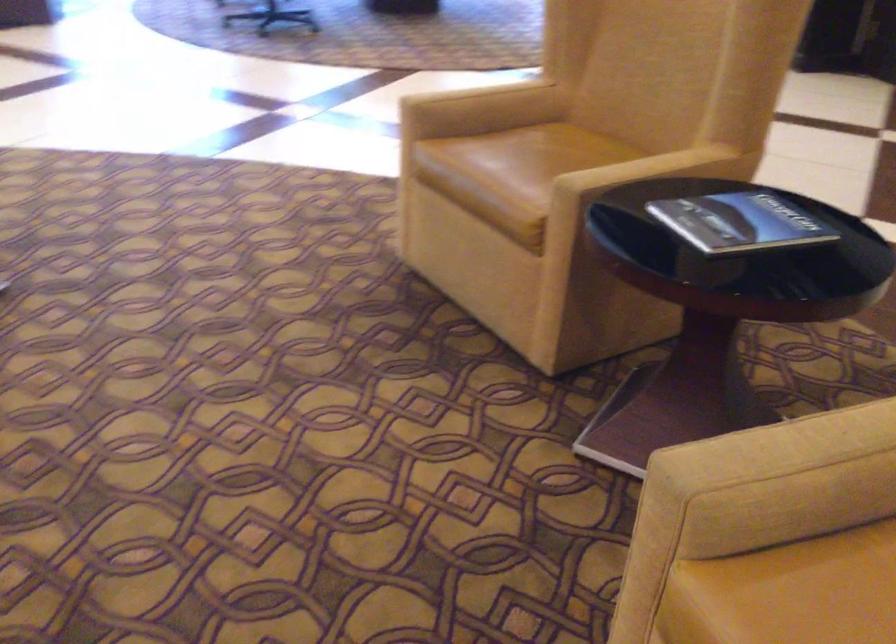
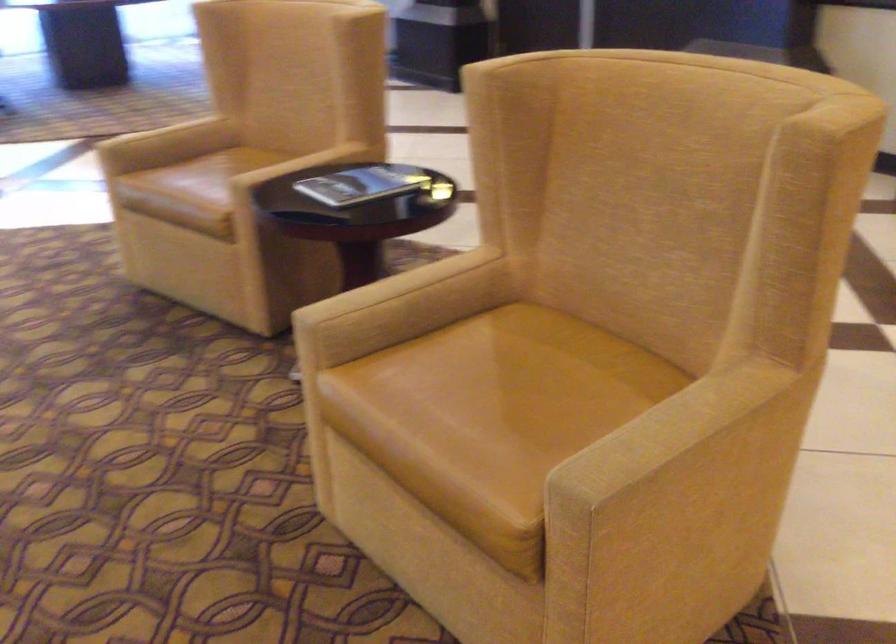
Where in the second image is the point corresponding to pixel 735 218 from the first image?

(363, 184)